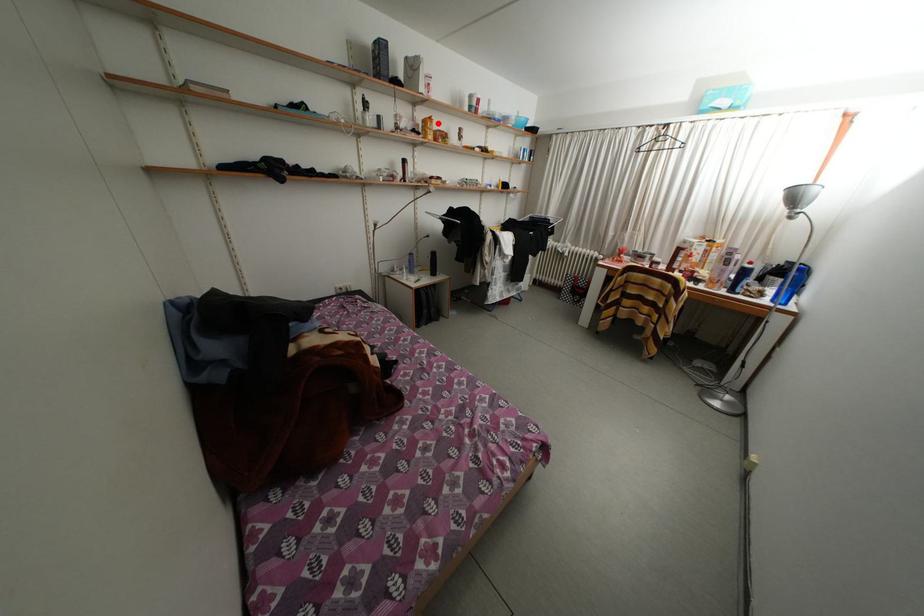
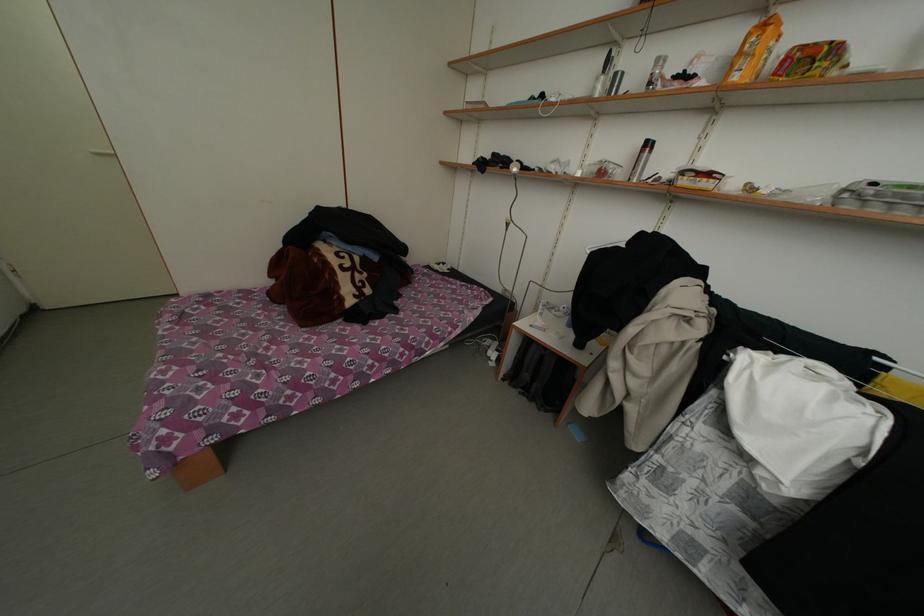
Find the pixel in the second image that matches the highlighted location in the first image.

(774, 29)